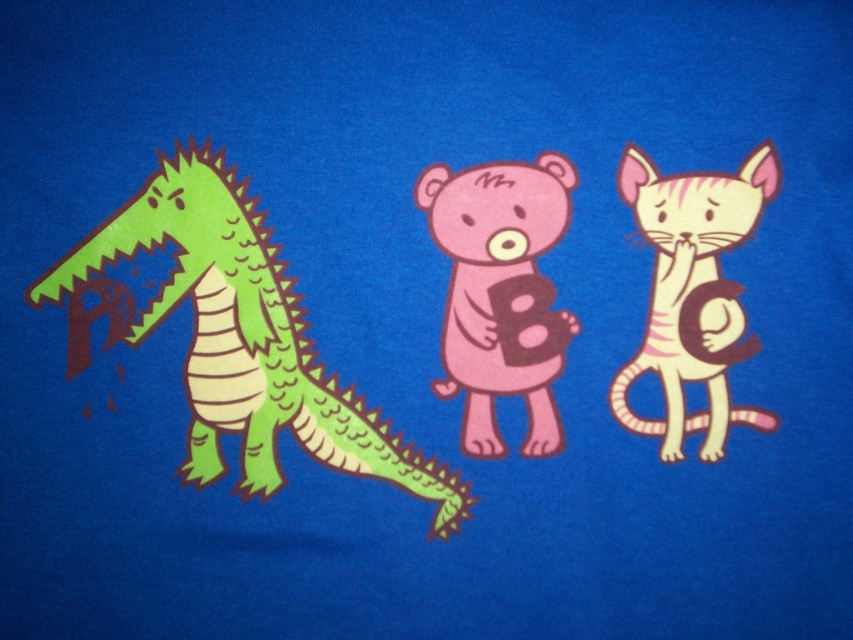
What is the color and texture of the object at point (502, 292)?

The object at point (502, 292) is a pink matte bear.

You are standing at point (393, 483) and want to move to the door located at point 0.85, 0.55. The distance between you and the door is 0.5 meters. Can you reach the door without moving more than 1 meter?

The distance between you and the door is 0.5 meters, so yes, you can reach the door without moving more than 1 meter.